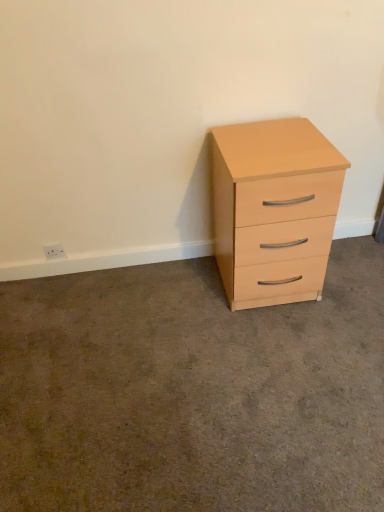
Find the location of a particular element. This screenshot has width=384, height=512. vacant space to the right of matte wood chest of drawers at right is located at coordinates (351, 280).